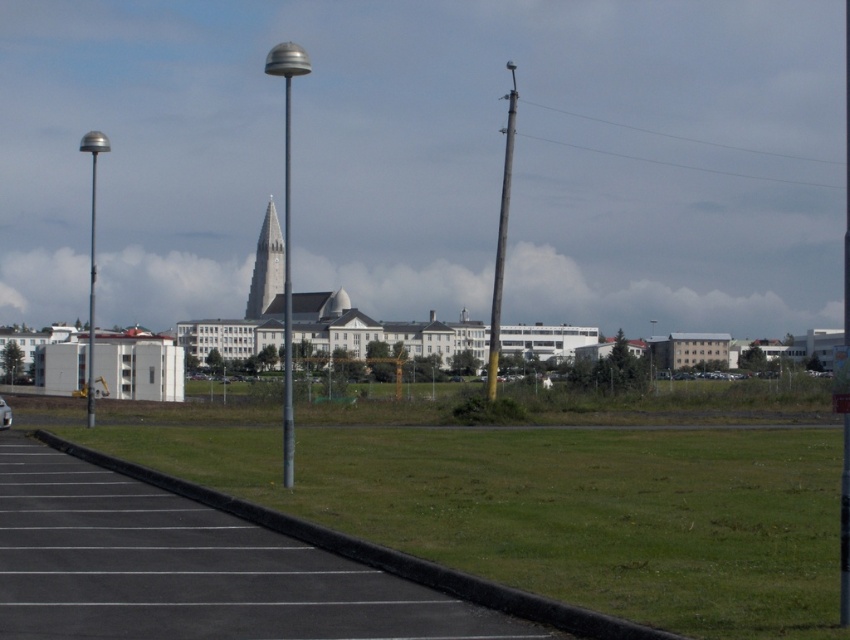
You are a delivery drone that needs to fly from the metallic gray pole at center to the smooth gray spire at center. The maximum flight distance of your drone is 50 meters. Can you safely make this trip without needing to recharge?

The distance between the metallic gray pole at center and the smooth gray spire at center is 45.60 meters, which is within the drone maximum flight distance of 50 meters. Yes, the drone can safely make this trip without needing to recharge.

You are a delivery driver who needs to park your vehicle between the polished silver pole at center and the metallic gray pole at center. Your vehicle is 2 meters wide. Can you fit your vehicle between them?

The polished silver pole at center is larger in size than metallic gray pole at center, but the distance between them is not provided. Without knowing the space between the two poles, it is impossible to determine if the vehicle can fit.

You are standing 50 meters away from the parking lot and want to reach the metallic gray pole at center. Is the pole within your walking distance?

The metallic gray pole at center is 47.19 meters away from the viewer, so yes, it is within walking distance as it is closer than 50 meters.